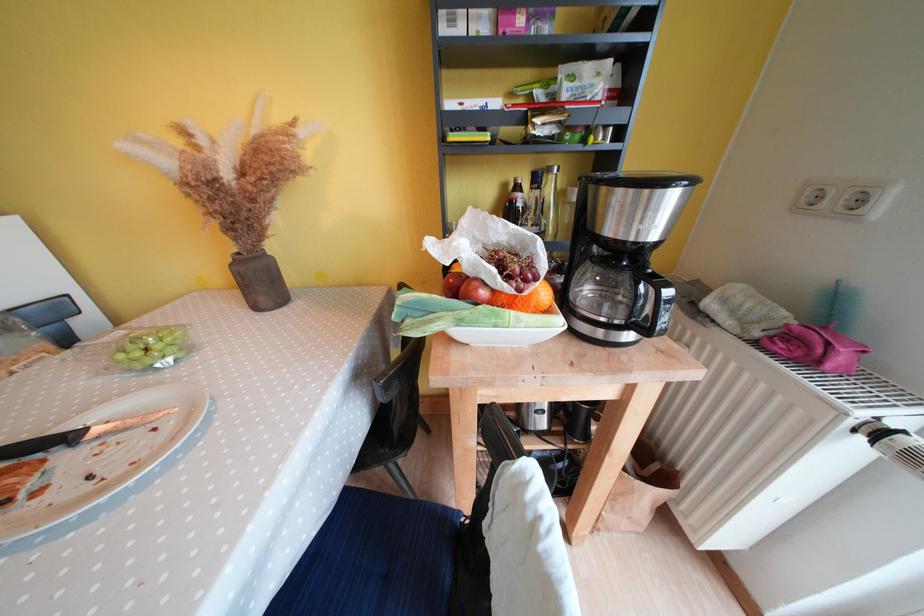
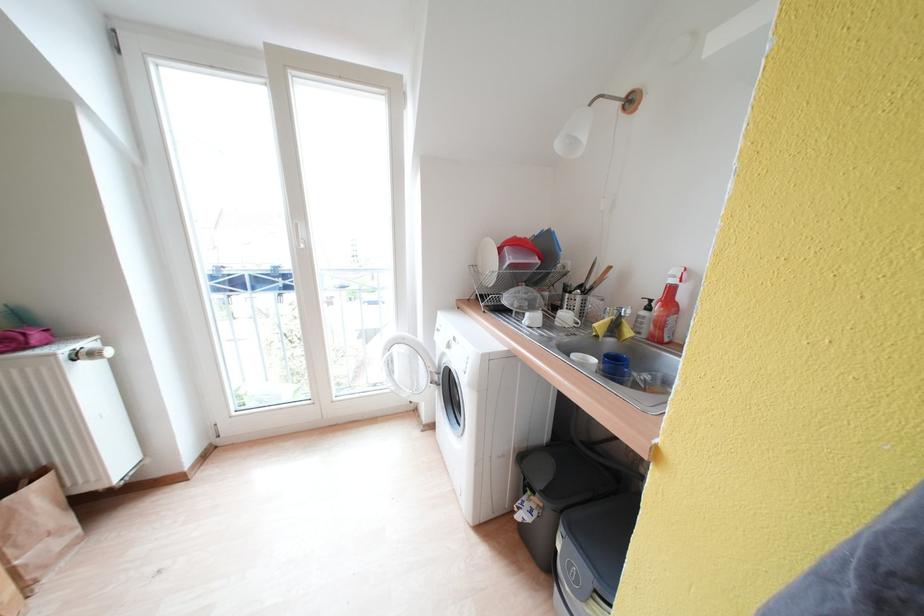
In the second image, find the point that corresponds to point (663, 469) in the first image.

(30, 485)